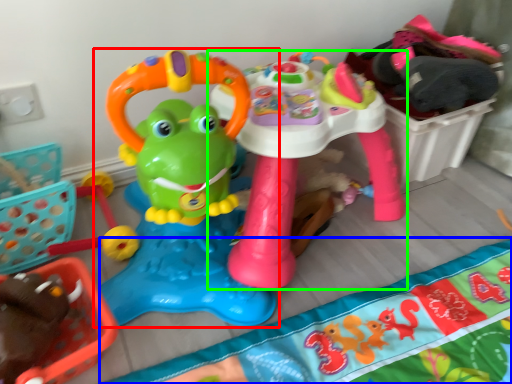
Question: Which object is positioned closest to toy (highlighted by a red box)? Select from blanket (highlighted by a blue box) and toy (highlighted by a green box).

Choices:
 (A) blanket
 (B) toy

Answer: (B)